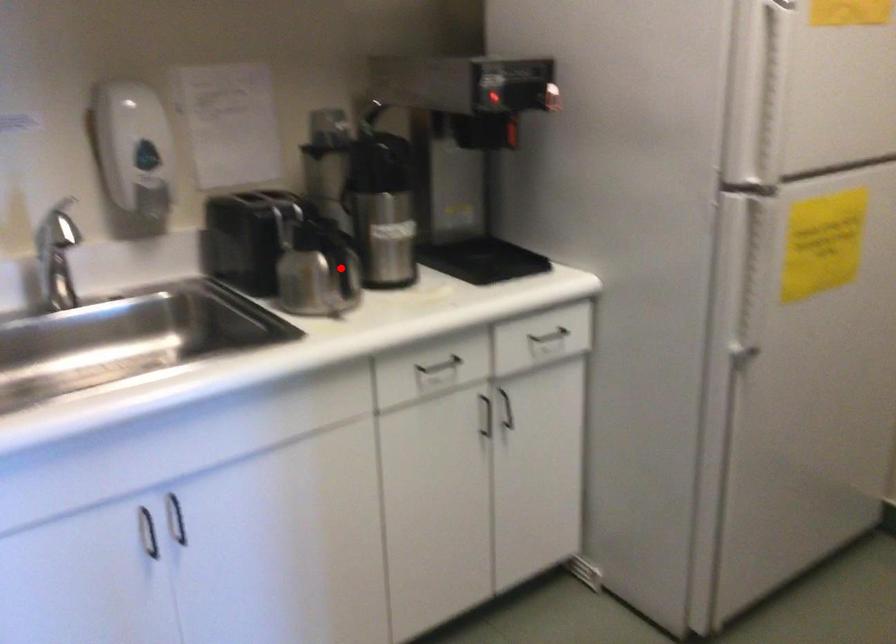
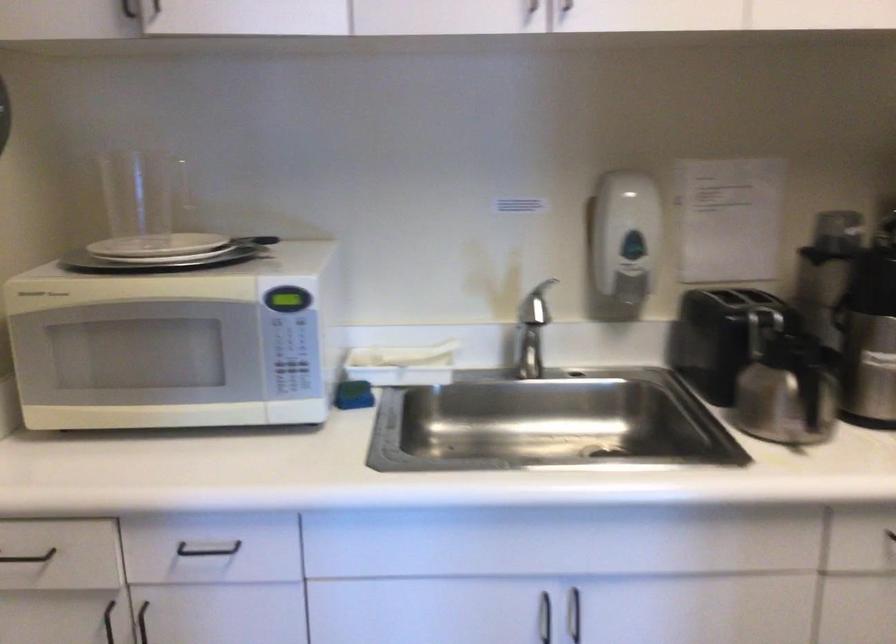
Question: I am providing you with two images of the same scene from different viewpoints. Image1 has a red point marked. In image2, the corresponding 3D location appears at what relative position? Reply with the corresponding letter.

Choices:
 (A) Closer
 (B) Farther

Answer: (A)